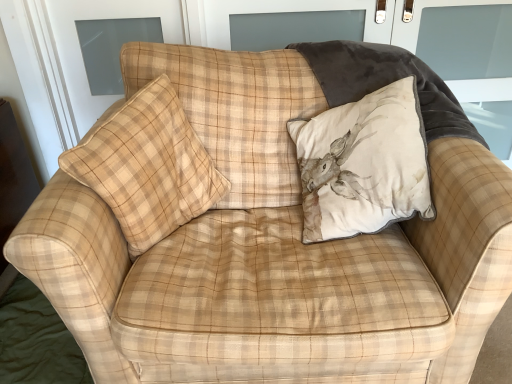
Based on the photo, in order to face beige velvet cushion with deer print at upper right, acting as the 2th pillow starting from the left, should I rotate leftwards or rightwards?

You should rotate right by 13.430 degrees.

Measure the distance between point (x=154, y=85) and camera.

They are 1.28 meters apart.

Locate an element on the screen. The image size is (512, 384). beige velvet cushion with deer print at upper right, acting as the 2th pillow starting from the left is located at coordinates (362, 164).

Between point (396, 25) and point (318, 231), which one is positioned behind?

The point (396, 25) is farther from the camera.

Is velvet screen door at upper right turned away from beige velvet cushion with deer print at upper right, acting as the 2th pillow starting from the left?

No, velvet screen door at upper right is not facing the opposite direction of beige velvet cushion with deer print at upper right, acting as the 2th pillow starting from the left.

From the picture: Can you tell me how much velvet screen door at upper right and beige velvet cushion with deer print at upper right, acting as the 2th pillow starting from the left, differ in facing direction?

The facing directions of velvet screen door at upper right and beige velvet cushion with deer print at upper right, acting as the 2th pillow starting from the left, are 1 degrees apart.

Does velvet screen door at upper right appear on the left side of beige plaid pillow at center, placed as the first pillow when sorted from left to right?

No.

Considering the positions of objects velvet screen door at upper right and beige plaid pillow at center, marked as the 2th pillow in a right-to-left arrangement, in the image provided, who is behind, velvet screen door at upper right or beige plaid pillow at center, marked as the 2th pillow in a right-to-left arrangement,?

velvet screen door at upper right.

Is velvet screen door at upper right shorter than beige plaid pillow at center, placed as the first pillow when sorted from left to right?

No, velvet screen door at upper right is not shorter than beige plaid pillow at center, placed as the first pillow when sorted from left to right.

Does point (393, 44) come closer to viewer compared to point (189, 204)?

That is False.

Relative to velvet screen door at upper right, is beige velvet cushion with deer print at upper right, the first pillow viewed from the right, in front or behind?

beige velvet cushion with deer print at upper right, the first pillow viewed from the right, is in front of velvet screen door at upper right.

Between point (353, 180) and point (417, 22), which one is positioned in front?

The point (353, 180) is in front.

From the image's perspective, is beige velvet cushion with deer print at upper right, acting as the 2th pillow starting from the left, under velvet screen door at upper right?

Correct, beige velvet cushion with deer print at upper right, acting as the 2th pillow starting from the left, appears lower than velvet screen door at upper right in the image.

Can you tell me how much beige plaid pillow at center, placed as the first pillow when sorted from left to right, and beige velvet cushion with deer print at upper right, acting as the 2th pillow starting from the left, differ in facing direction?

They differ by 50.6 degrees in their facing directions.

Is beige plaid pillow at center, marked as the 2th pillow in a right-to-left arrangement, directly adjacent to beige velvet cushion with deer print at upper right, acting as the 2th pillow starting from the left?

No, beige plaid pillow at center, marked as the 2th pillow in a right-to-left arrangement, is not in contact with beige velvet cushion with deer print at upper right, acting as the 2th pillow starting from the left.

Is beige plaid pillow at center, marked as the 2th pillow in a right-to-left arrangement, looking in the opposite direction of beige velvet cushion with deer print at upper right, the first pillow viewed from the right?

beige plaid pillow at center, marked as the 2th pillow in a right-to-left arrangement, does not have its back to beige velvet cushion with deer print at upper right, the first pillow viewed from the right.

Which is correct: beige plaid pillow at center, marked as the 2th pillow in a right-to-left arrangement, is inside beige velvet cushion with deer print at upper right, acting as the 2th pillow starting from the left, or outside of it?

beige plaid pillow at center, marked as the 2th pillow in a right-to-left arrangement, exists outside the volume of beige velvet cushion with deer print at upper right, acting as the 2th pillow starting from the left.

Between beige plaid pillow at center, placed as the first pillow when sorted from left to right, and velvet screen door at upper right, which one has smaller width?

velvet screen door at upper right is thinner.

Which is more to the right, beige plaid pillow at center, marked as the 2th pillow in a right-to-left arrangement, or velvet screen door at upper right?

From the viewer's perspective, velvet screen door at upper right appears more on the right side.

Where is `screen door behind the beige plaid pillow at center, placed as the first pillow when sorted from left to right`? screen door behind the beige plaid pillow at center, placed as the first pillow when sorted from left to right is located at coordinates (420, 19).

From the image's perspective, is beige plaid pillow at center, marked as the 2th pillow in a right-to-left arrangement, positioned above or below velvet screen door at upper right?

Clearly, from the image's perspective, beige plaid pillow at center, marked as the 2th pillow in a right-to-left arrangement, is below velvet screen door at upper right.

Consider the image. From the image's perspective, does beige velvet cushion with deer print at upper right, the first pillow viewed from the right, appear lower than beige plaid pillow at center, marked as the 2th pillow in a right-to-left arrangement?

No.

How many degrees apart are the facing directions of beige velvet cushion with deer print at upper right, the first pillow viewed from the right, and beige plaid pillow at center, marked as the 2th pillow in a right-to-left arrangement?

The facing directions of beige velvet cushion with deer print at upper right, the first pillow viewed from the right, and beige plaid pillow at center, marked as the 2th pillow in a right-to-left arrangement, are 50.6 degrees apart.

Is beige velvet cushion with deer print at upper right, the first pillow viewed from the right, positioned with its back to beige plaid pillow at center, marked as the 2th pillow in a right-to-left arrangement?

beige velvet cushion with deer print at upper right, the first pillow viewed from the right, is not turned away from beige plaid pillow at center, marked as the 2th pillow in a right-to-left arrangement.

Does point (381, 209) come in front of point (160, 155)?

No, (381, 209) is behind (160, 155).

Locate an element on the screen. The height and width of the screenshot is (384, 512). pillow that is the 1st one when counting downward from the velvet screen door at upper right (from the image's perspective) is located at coordinates (362, 164).

This screenshot has width=512, height=384. Identify the location of screen door behind the beige plaid pillow at center, placed as the first pillow when sorted from left to right. (420, 19).

Estimate the real-world distances between objects in this image. Which object is further from beige velvet cushion with deer print at upper right, acting as the 2th pillow starting from the left, velvet screen door at upper right or beige plaid pillow at center, marked as the 2th pillow in a right-to-left arrangement?

Result: velvet screen door at upper right is further to beige velvet cushion with deer print at upper right, acting as the 2th pillow starting from the left.

Looking at the image, which one is located further to velvet screen door at upper right, beige plaid pillow at center, marked as the 2th pillow in a right-to-left arrangement, or beige velvet cushion with deer print at upper right, acting as the 2th pillow starting from the left?

Based on the image, beige plaid pillow at center, marked as the 2th pillow in a right-to-left arrangement, appears to be further to velvet screen door at upper right.

When comparing their distances from beige plaid pillow at center, placed as the first pillow when sorted from left to right, does velvet screen door at upper right or beige velvet cushion with deer print at upper right, the first pillow viewed from the right, seem further?

velvet screen door at upper right.

From the image, which object appears to be farther from beige plaid pillow at center, placed as the first pillow when sorted from left to right, beige velvet cushion with deer print at upper right, acting as the 2th pillow starting from the left, or velvet screen door at upper right?

velvet screen door at upper right is further to beige plaid pillow at center, placed as the first pillow when sorted from left to right.

Considering their positions, is beige plaid pillow at center, marked as the 2th pillow in a right-to-left arrangement, positioned closer to beige velvet cushion with deer print at upper right, the first pillow viewed from the right, than velvet screen door at upper right?

The object closer to beige velvet cushion with deer print at upper right, the first pillow viewed from the right, is beige plaid pillow at center, marked as the 2th pillow in a right-to-left arrangement.

Based on their spatial positions, is beige velvet cushion with deer print at upper right, the first pillow viewed from the right, or beige plaid pillow at center, placed as the first pillow when sorted from left to right, closer to velvet screen door at upper right?

Based on the image, beige velvet cushion with deer print at upper right, the first pillow viewed from the right, appears to be nearer to velvet screen door at upper right.

Identify the location of pillow between beige plaid pillow at center, marked as the 2th pillow in a right-to-left arrangement, and velvet screen door at upper right, in the horizontal direction. Image resolution: width=512 pixels, height=384 pixels. (362, 164).